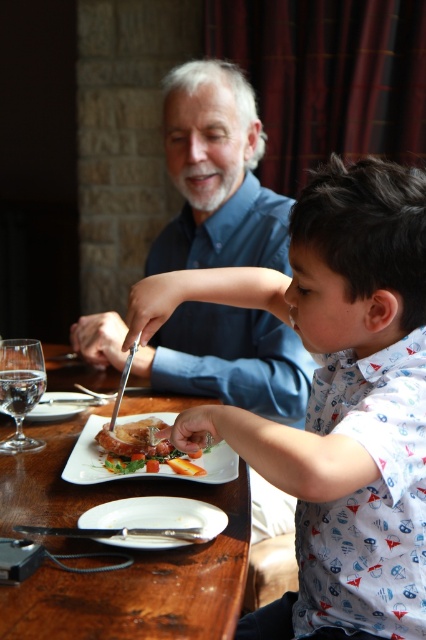
You are a chef preparing a dish and need to place the golden brown crispy chicken at center on top of the white matte plate at lower center. Can you do this without the plate breaking?

The white matte plate at lower center is thinner than golden brown crispy chicken at center, so it may not be able to support the chicken properly. Choose a sturdier plate instead.

You are a waiter in a restaurant and need to place a new wine glass on the table. The existing clear glass wine glass at left is already occupied. Where should you place the new glass so it doesn not block the view of the wooden table at center?

The new wine glass should be placed to the right of the clear glass wine glass at left, since the wooden table at center is already positioned to its right and moving the new glass further right would keep it out of the way while maintaining visibility of the table.